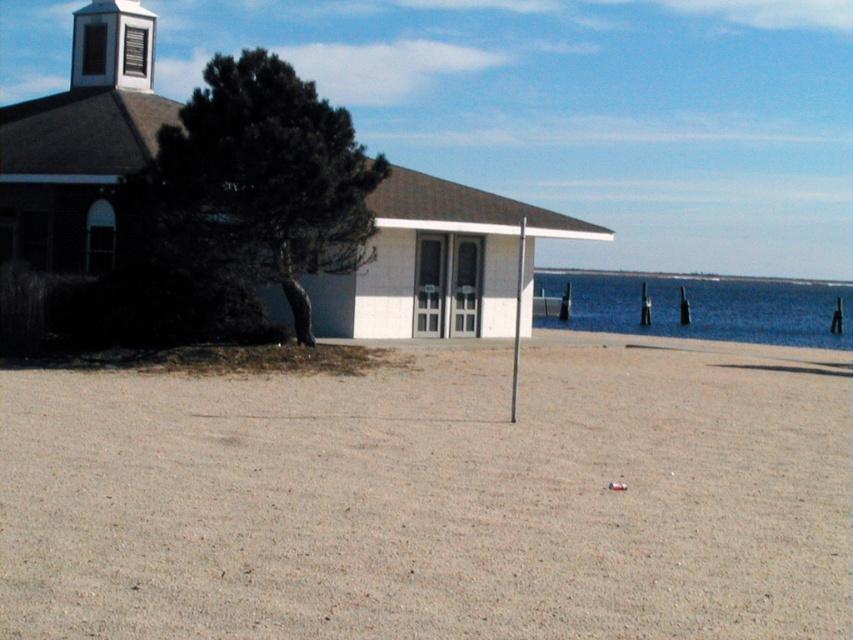
Which is below, white matte building at center or blue water at lower right?

blue water at lower right is below.

Is point (0, 131) positioned in front of point (570, 326)?

Yes, it is.

Image resolution: width=853 pixels, height=640 pixels. Find the location of `white matte building at center`. white matte building at center is located at coordinates (80, 144).

Find the location of a particular element. brown sandy dirt at center is located at coordinates (434, 497).

Where is `brown sandy dirt at center`? brown sandy dirt at center is located at coordinates (434, 497).

Find the location of a particular element. The width and height of the screenshot is (853, 640). brown sandy dirt at center is located at coordinates (434, 497).

Who is lower down, brown sandy dirt at center or white matte building at center?

brown sandy dirt at center

Is point (689, 586) positioned before point (402, 330)?

Yes.

At what (x,y) coordinates should I click in order to perform the action: click on brown sandy dirt at center. Please return your answer as a coordinate pair (x, y). The image size is (853, 640). Looking at the image, I should click on (434, 497).